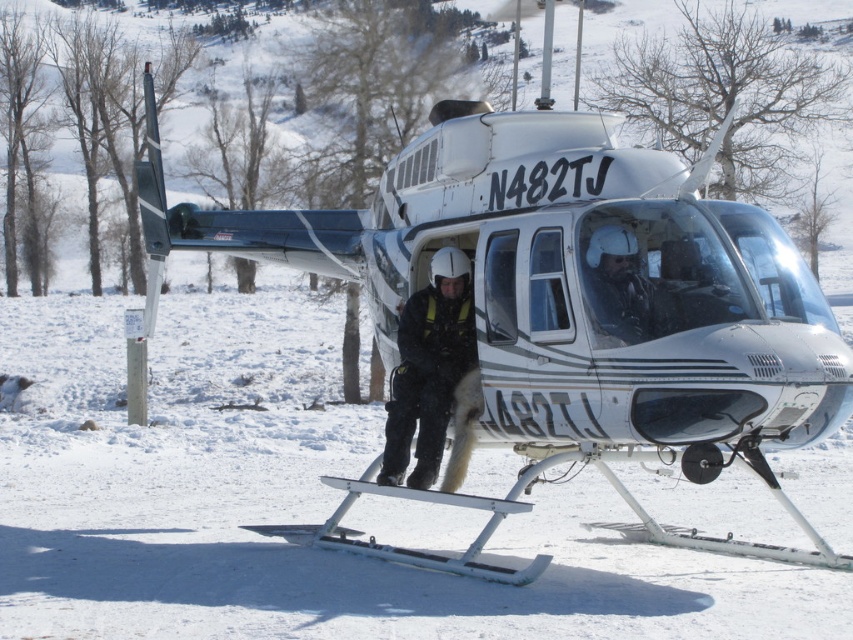
Question: From the image, what is the correct spatial relationship of white glossy helicopter at center in relation to matte black helmet at center?

Choices:
 (A) right
 (B) left

Answer: (B)

Question: Considering the relative positions of white glossy helicopter at center and black matte uniform at center in the image provided, where is white glossy helicopter at center located with respect to black matte uniform at center?

Choices:
 (A) below
 (B) above

Answer: (A)

Question: Which is nearer to the black matte uniform at center?

Choices:
 (A) matte black helmet at center
 (B) white glossy helicopter at center

Answer: (B)

Question: Which is nearer to the white glossy helicopter at center?

Choices:
 (A) black matte uniform at center
 (B) matte black helmet at center

Answer: (A)

Question: Which object is the closest to the matte black helmet at center?

Choices:
 (A) black matte uniform at center
 (B) white glossy helicopter at center

Answer: (A)

Question: Does white glossy helicopter at center come in front of black matte uniform at center?

Choices:
 (A) yes
 (B) no

Answer: (A)